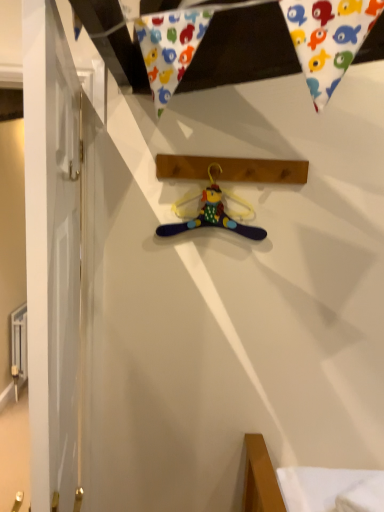
Question: Is purple fabric hanger at center taller than brown wooden plank at center?

Choices:
 (A) no
 (B) yes

Answer: (B)

Question: Is purple fabric hanger at center in front of brown wooden plank at center?

Choices:
 (A) yes
 (B) no

Answer: (B)

Question: Is brown wooden plank at center at the back of purple fabric hanger at center?

Choices:
 (A) yes
 (B) no

Answer: (B)

Question: From a real-world perspective, does purple fabric hanger at center sit lower than brown wooden plank at center?

Choices:
 (A) yes
 (B) no

Answer: (A)

Question: Is purple fabric hanger at center shorter than brown wooden plank at center?

Choices:
 (A) yes
 (B) no

Answer: (B)

Question: Does purple fabric hanger at center turn towards brown wooden plank at center?

Choices:
 (A) no
 (B) yes

Answer: (A)

Question: From the image's perspective, is brown wooden plank at center above purple fabric hanger at center?

Choices:
 (A) yes
 (B) no

Answer: (A)

Question: Does brown wooden plank at center have a greater height compared to purple fabric hanger at center?

Choices:
 (A) no
 (B) yes

Answer: (A)

Question: Is brown wooden plank at center far away from purple fabric hanger at center?

Choices:
 (A) no
 (B) yes

Answer: (A)

Question: From the image's perspective, is brown wooden plank at center located beneath purple fabric hanger at center?

Choices:
 (A) no
 (B) yes

Answer: (A)

Question: Is brown wooden plank at center beside purple fabric hanger at center?

Choices:
 (A) yes
 (B) no

Answer: (B)

Question: Is brown wooden plank at center aimed at purple fabric hanger at center?

Choices:
 (A) no
 (B) yes

Answer: (A)

Question: Relative to brown wooden plank at center, is purple fabric hanger at center in front or behind?

Choices:
 (A) behind
 (B) front

Answer: (A)